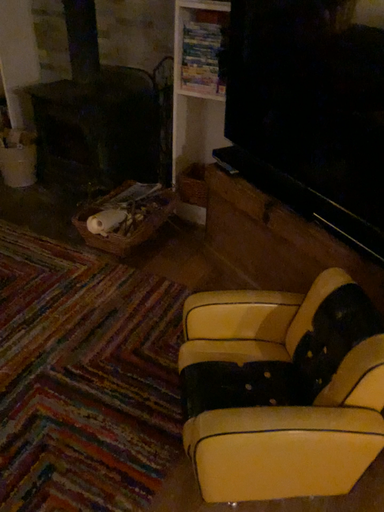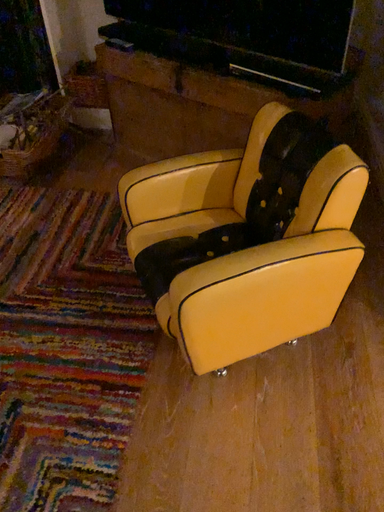
Question: How did the camera likely rotate when shooting the video?

Choices:
 (A) rotated left
 (B) rotated right

Answer: (B)